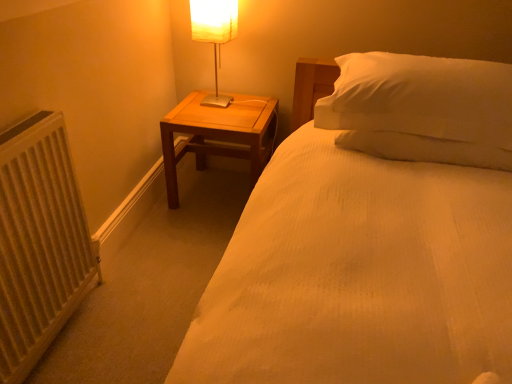
I want to click on vacant space in front of white fabric-covered lamp at upper left, so 196,125.